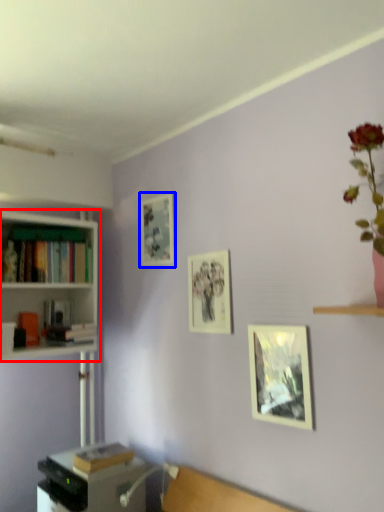
Question: Which object appears closest to the camera in this image, bookcase (highlighted by a red box) or picture frame (highlighted by a blue box)?

Choices:
 (A) bookcase
 (B) picture frame

Answer: (A)